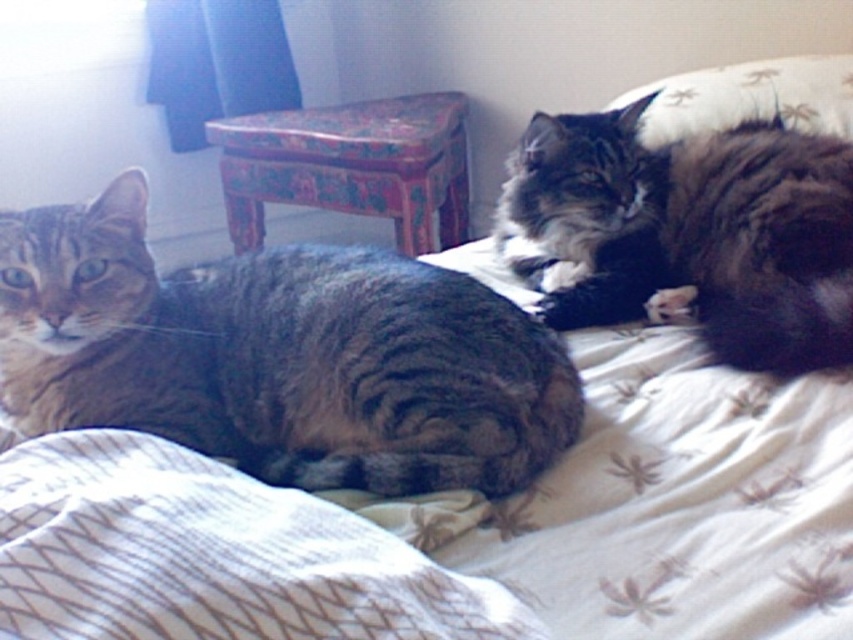
What are the coordinates of the dark brown fur at upper right?

The coordinates of the dark brown fur at upper right are (692, 230).

You are a photographer trying to capture a closeup of the tabby fur cat at left. You are currently positioned at point (277, 355). Which direction should you move to get a better shot of the tabby fur cat at left?

Since the point (277, 355) is on the tabby fur cat at left, you are already positioned directly on the cat. To get a better shot, you might want to move slightly backward to frame the cat properly without being too close.